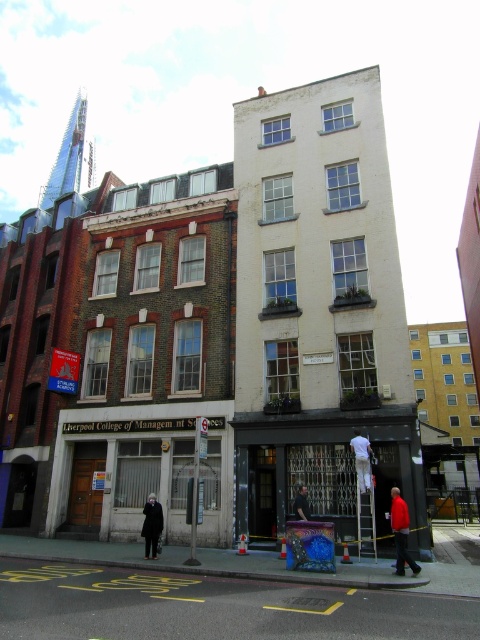
Question: In this image, where is white fabric at center located relative to dark hair at center?

Choices:
 (A) below
 (B) above

Answer: (B)

Question: Which object is positioned farthest from the red cotton shirt at lower right?

Choices:
 (A) dark hair at center
 (B) black wool coat at center

Answer: (B)

Question: Can you confirm if red cotton shirt at lower right is smaller than dark hair at center?

Choices:
 (A) yes
 (B) no

Answer: (B)

Question: Which point is farther from the camera taking this photo?

Choices:
 (A) (141, 532)
 (B) (301, 492)
 (C) (354, 444)

Answer: (A)

Question: Which object is the closest to the red cotton shirt at lower right?

Choices:
 (A) black wool coat at center
 (B) white fabric at center
 (C) dark hair at center

Answer: (B)

Question: Is black wool coat at center thinner than dark hair at center?

Choices:
 (A) no
 (B) yes

Answer: (A)